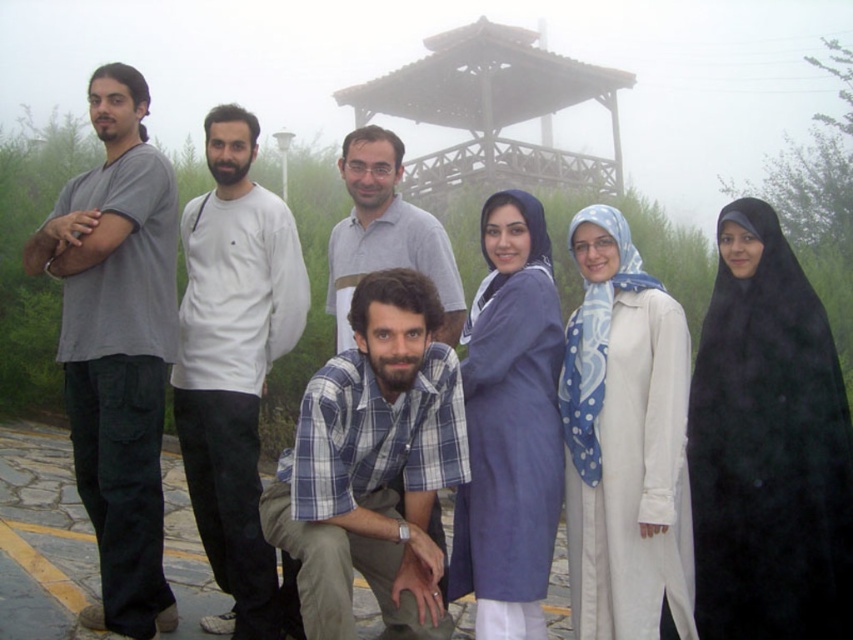
Between black matte robe at lower right and wooden gazebo at upper center, which one has more height?

wooden gazebo at upper center

Is black matte robe at lower right thinner than wooden gazebo at upper center?

Indeed, black matte robe at lower right has a lesser width compared to wooden gazebo at upper center.

Which is behind, point (845, 552) or point (437, 83)?

The point (437, 83) is more distant.

Find the location of a particular element. Image resolution: width=853 pixels, height=640 pixels. black matte robe at lower right is located at coordinates (769, 445).

Does blue plaid shirt at center have a smaller size compared to matte gray shirt at center?

Yes.

Is blue plaid shirt at center bigger than matte gray shirt at center?

No.

The image size is (853, 640). Find the location of `blue plaid shirt at center`. blue plaid shirt at center is located at coordinates (x=373, y=465).

Is white matte robe at center above matte gray shirt at center?

Incorrect, white matte robe at center is not positioned above matte gray shirt at center.

Which is more to the left, white matte robe at center or matte gray shirt at center?

From the viewer's perspective, matte gray shirt at center appears more on the left side.

What are the coordinates of `white matte robe at center` in the screenshot? It's located at (624, 440).